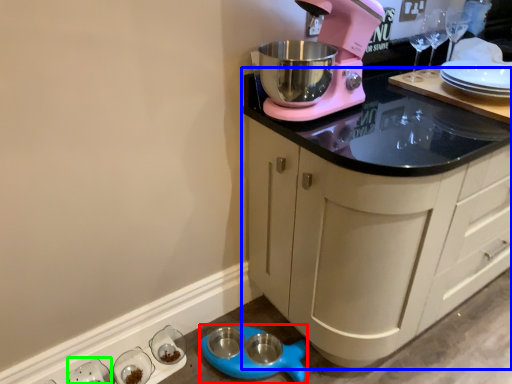
Question: Which object is positioned farthest from appliance (highlighted by a red box)? Select from cabinetry (highlighted by a blue box) and tableware (highlighted by a green box).

Choices:
 (A) cabinetry
 (B) tableware

Answer: (A)